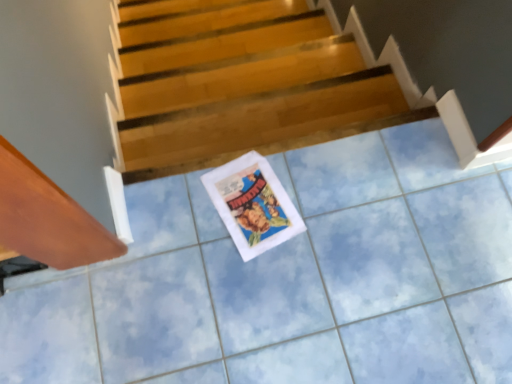
Question: Choose the correct answer: Is wooden stairs at center inside white paper comic book at center or outside it?

Choices:
 (A) outside
 (B) inside

Answer: (A)

Question: From a real-world perspective, is wooden stairs at center physically located above or below white paper comic book at center?

Choices:
 (A) below
 (B) above

Answer: (A)

Question: Considering their positions, is wooden stairs at center located in front of or behind white paper comic book at center?

Choices:
 (A) front
 (B) behind

Answer: (B)

Question: Choose the correct answer: Is white paper comic book at center inside wooden stairs at center or outside it?

Choices:
 (A) outside
 (B) inside

Answer: (A)

Question: From a real-world perspective, relative to wooden stairs at center, is white paper comic book at center vertically above or below?

Choices:
 (A) below
 (B) above

Answer: (B)

Question: From the image's perspective, is white paper comic book at center positioned above or below wooden stairs at center?

Choices:
 (A) below
 (B) above

Answer: (A)

Question: Is point (245, 162) positioned closer to the camera than point (229, 1)?

Choices:
 (A) farther
 (B) closer

Answer: (B)